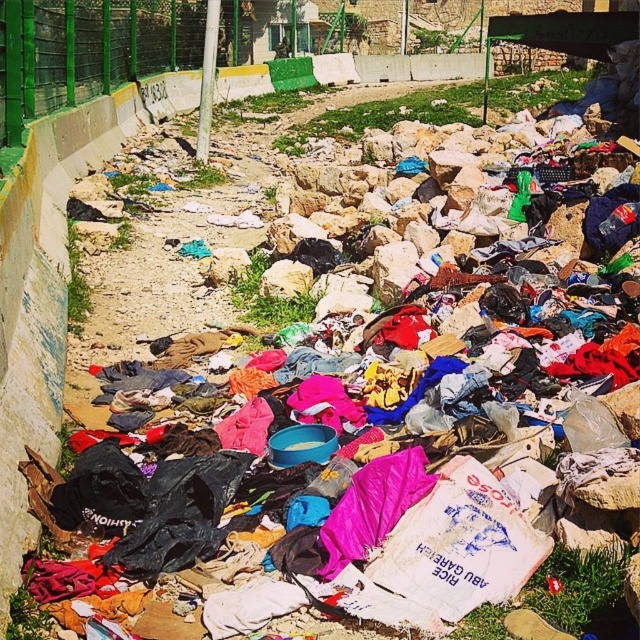
You are a landscape architect reviewing this area. You notice the green metal fence at upper center and the green grass at upper center. Which one is positioned higher in the image?

The green grass at upper center is positioned higher since the green metal fence at upper center is located below it.

Based on the scene described, which object is positioned to the left when observing the green metal fence at upper center and the green grass at upper center?

The green metal fence at upper center is to the left of the green grass at upper center.

You are standing in the scene and want to locate the green metal fence at upper center. What are the coordinates where you can find it?

The green metal fence at upper center can be found at coordinates point (88, 51).